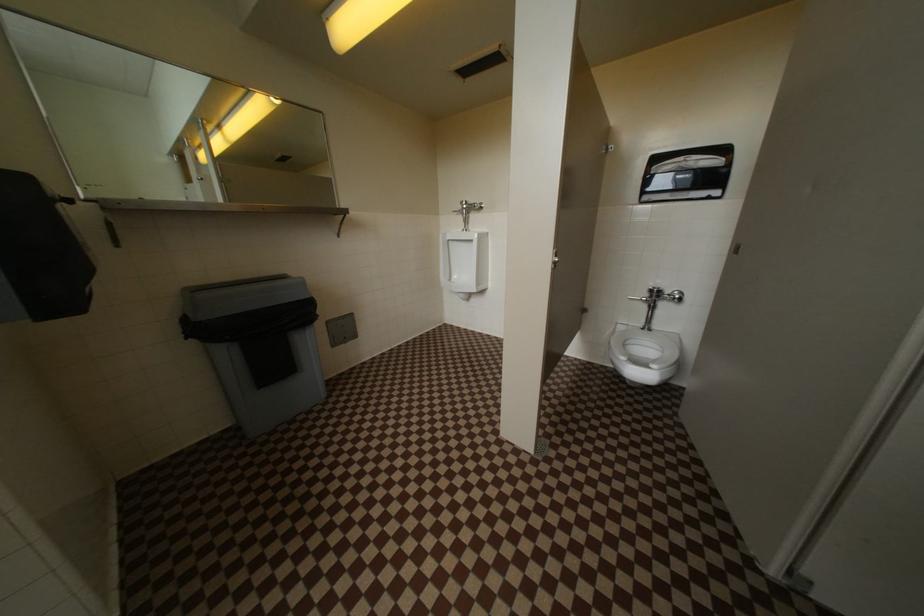
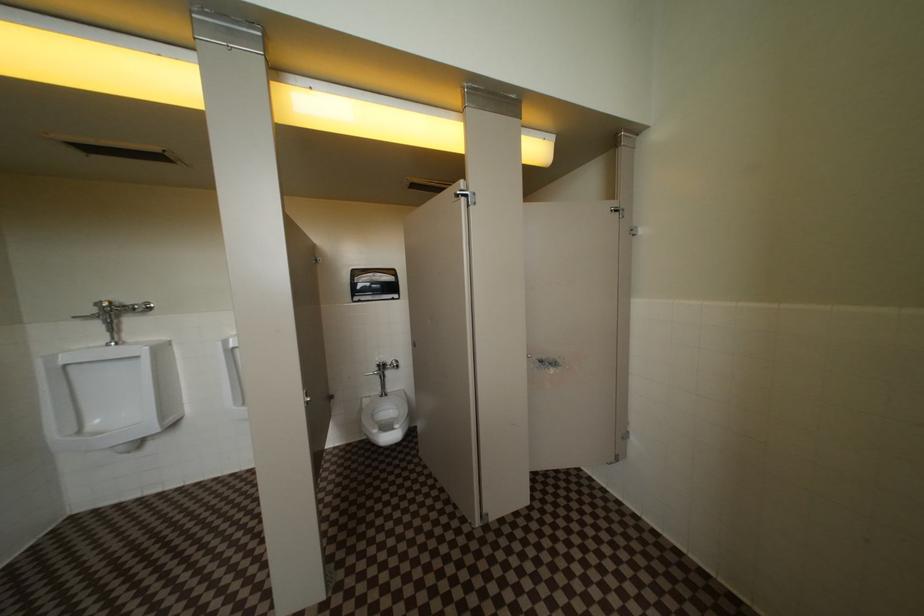
Question: The images are taken continuously from a first-person perspective. In which direction is your viewpoint rotating?

Choices:
 (A) Left
 (B) Right
 (C) Up
 (D) Down

Answer: (B)